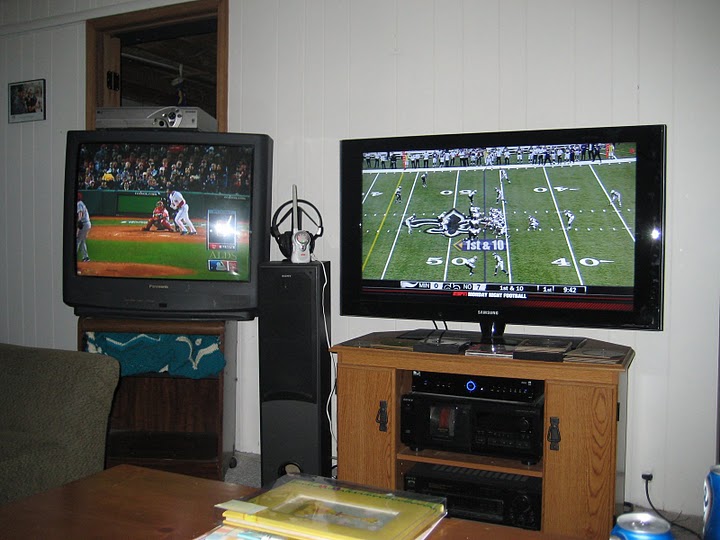
Find the location of a particular element. This screenshot has height=540, width=720. stereo equipment is located at coordinates (495, 503), (487, 453).